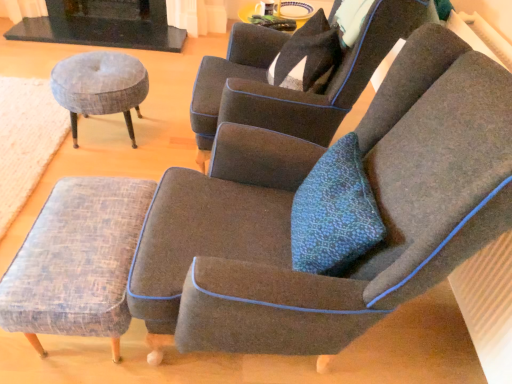
At what (x,y) coordinates should I click in order to perform the action: click on free spot below textured gray fabric stool at left, arranged as the first stool when viewed from the back (from a real-world perspective). Please return your answer as a coordinate pair (x, y). Looking at the image, I should click on (106, 137).